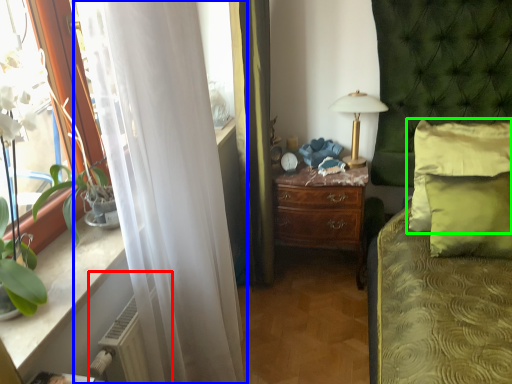
Question: Estimate the real-world distances between objects in this image. Which object is farther from radiator (highlighted by a red box), curtain (highlighted by a blue box) or pillow (highlighted by a green box)?

Choices:
 (A) curtain
 (B) pillow

Answer: (B)